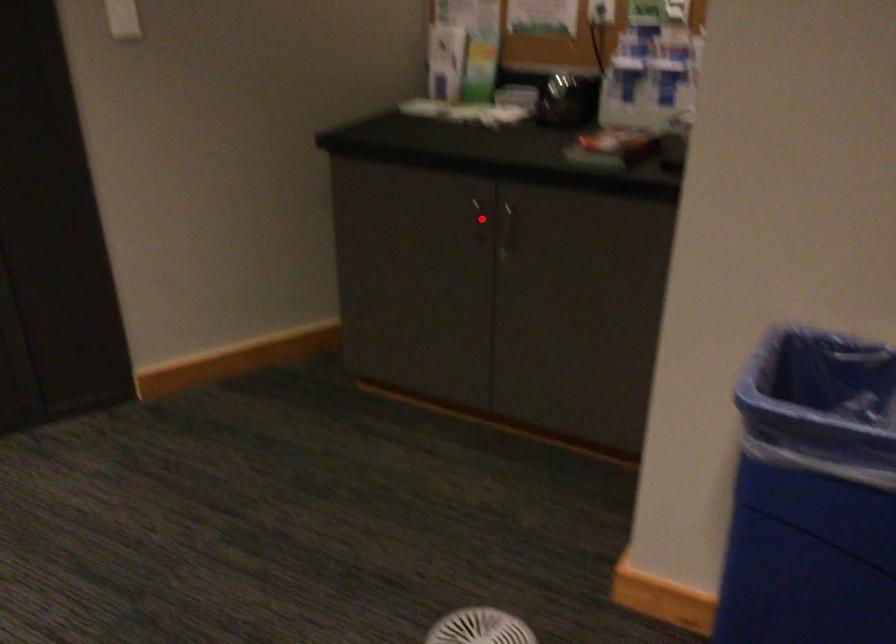
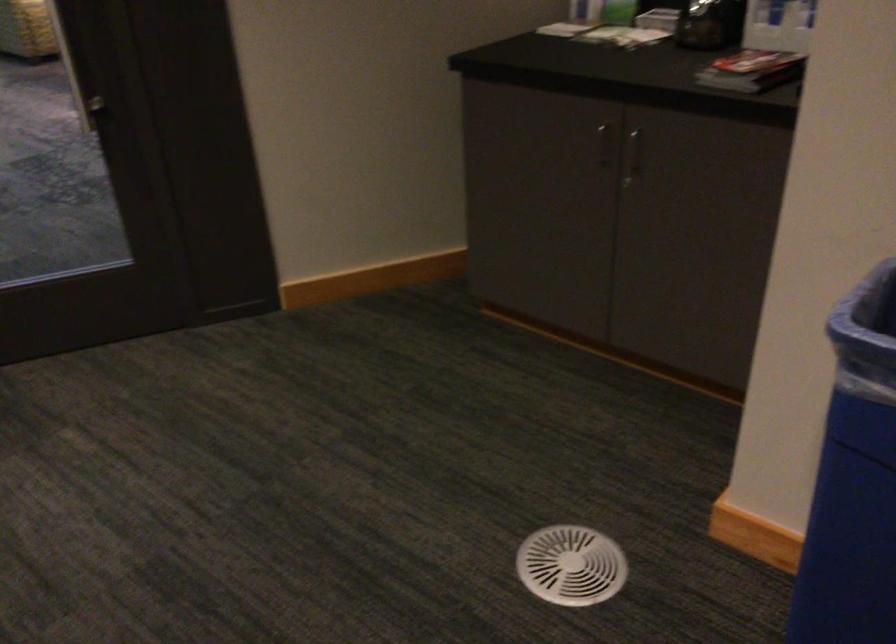
Where in the second image is the point corresponding to the highlighted location from the first image?

(604, 144)